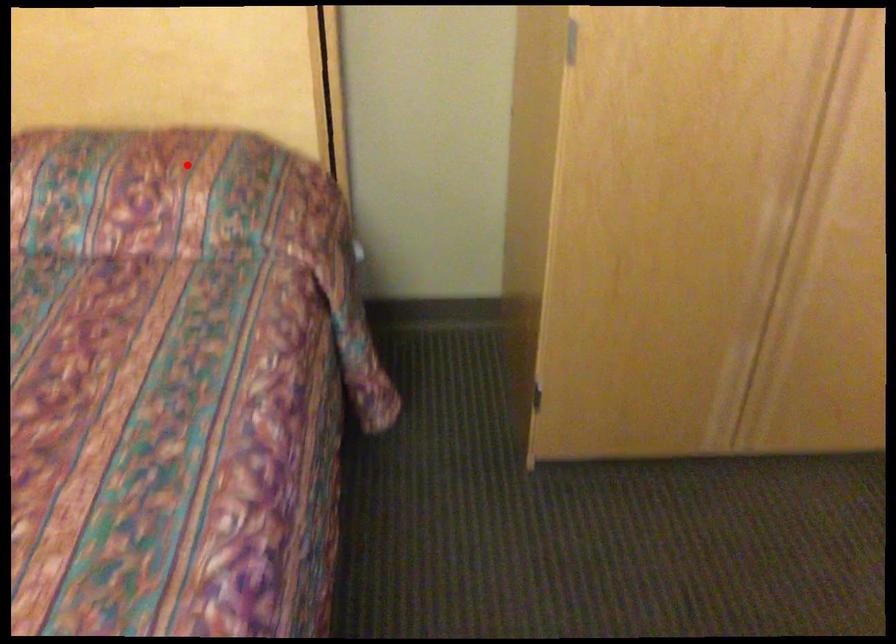
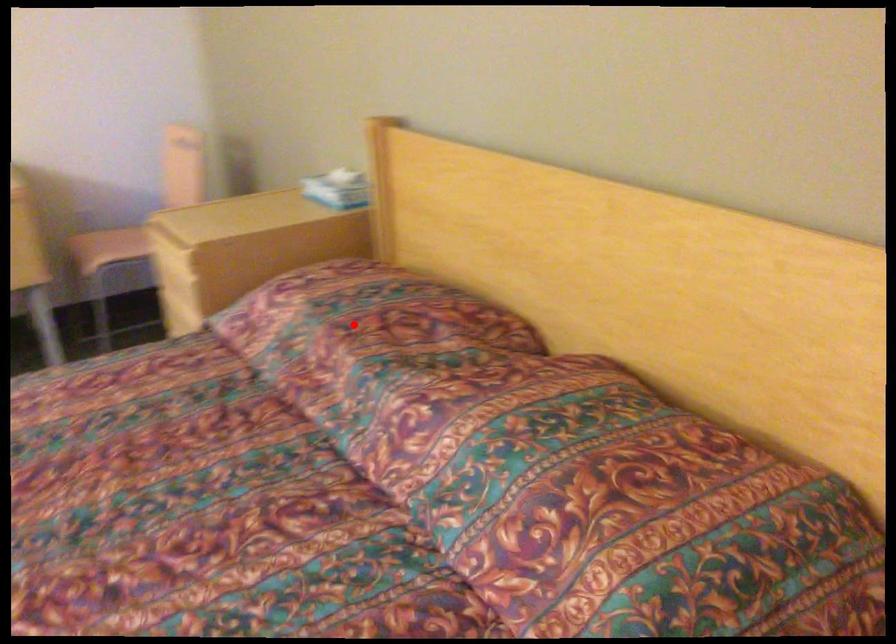
I am providing you with two images of the same scene from different viewpoints. A red point is marked on the first image and another point is marked on the second image. Do the highlighted points in image1 and image2 indicate the same real-world spot?

No